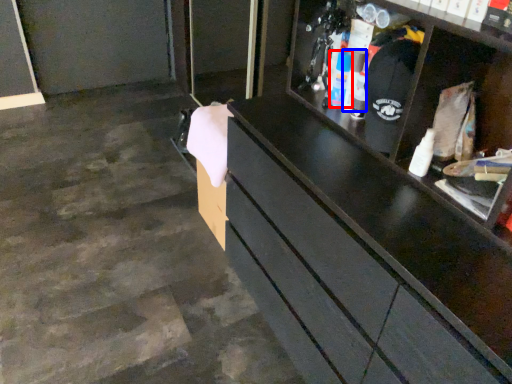
Question: Which object appears closest to the camera in this image, toiletry (highlighted by a red box) or toiletry (highlighted by a blue box)?

Choices:
 (A) toiletry
 (B) toiletry

Answer: (B)